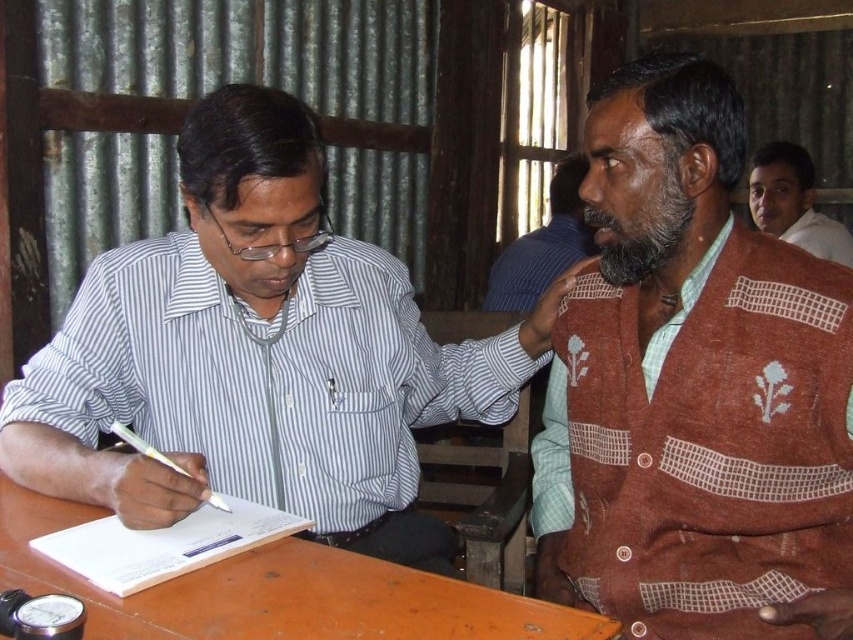
You are organizing a photo shoot and need to ensure that the striped cotton shirt at left is visible in the frame. Given that the brown wooden table at lower left is blocking part of the shirt, can you determine if the shirt is still fully visible above the table?

The striped cotton shirt at left is located above the brown wooden table at lower left, so it is fully visible and not blocked by the table.

You are an observer in the scene. Where is the brown knitted sweater at upper right located in the image?

The brown knitted sweater at upper right is located at point (543, 244).

You are standing in the room and want to move from the point at coordinates point (566,220) to the point at coordinates point (782,225). Which direction should you move in?

You should move backward because point (566,220) is in front of point (782,225).